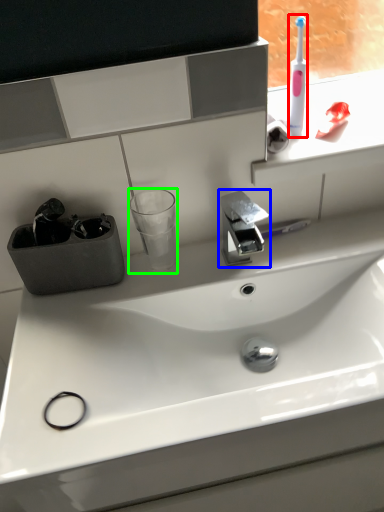
Question: Which object is the farthest from toothbrush (highlighted by a red box)? Choose among these: tap (highlighted by a blue box) or shot glass (highlighted by a green box).

Choices:
 (A) tap
 (B) shot glass

Answer: (B)